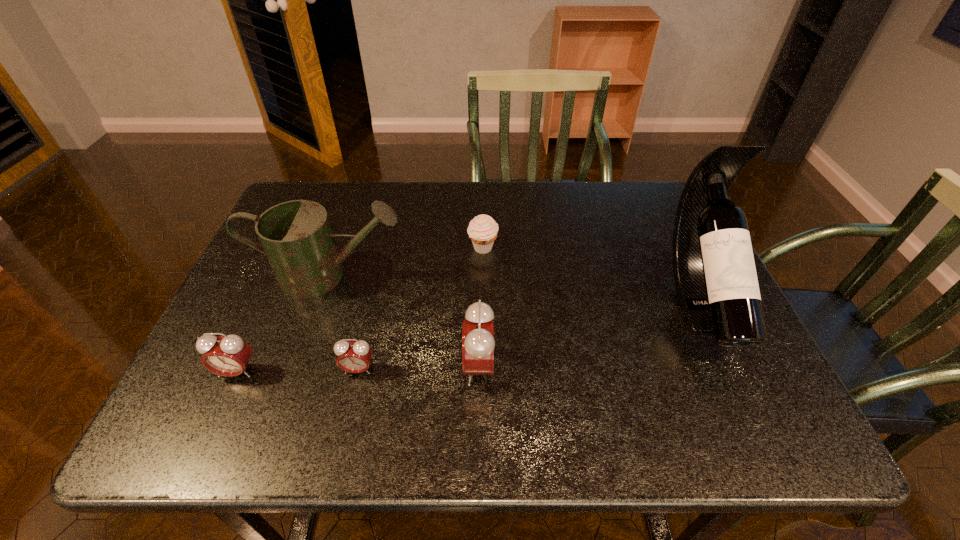
The width and height of the screenshot is (960, 540). In order to click on vacant place for an extra alarm clock on the right in this screenshot , I will do `click(598, 365)`.